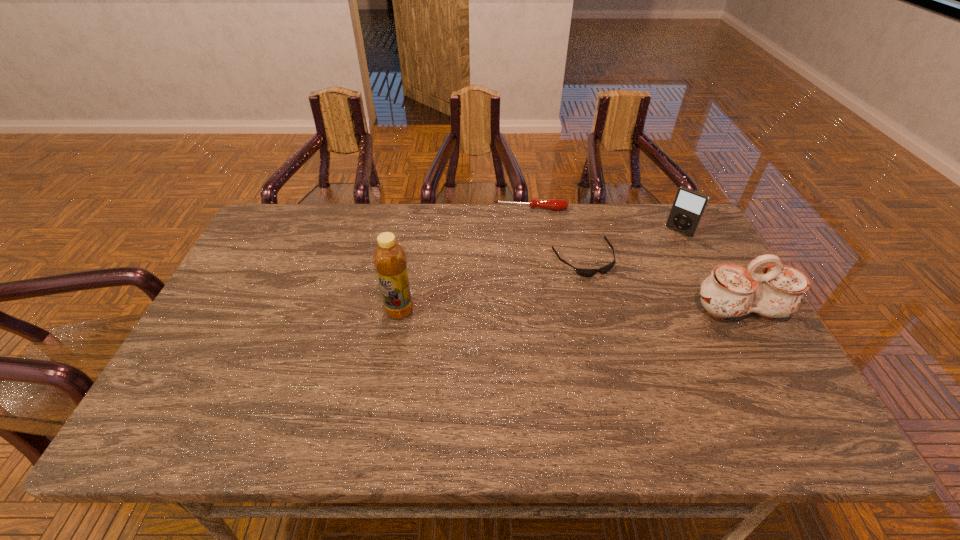
Identify the location of vacant spot on the desktop that is between the tallest object and the second tallest object and is positioned at the tip of the farthest object. Image resolution: width=960 pixels, height=540 pixels. pyautogui.click(x=529, y=310).

Locate an element on the screen. Image resolution: width=960 pixels, height=540 pixels. vacant spot on the desktop that is between the leftmost object and the chinaware and is positioned on the front-facing side of the shortest object is located at coordinates (618, 310).

The width and height of the screenshot is (960, 540). I want to click on free space on the desktop that is between the tallest object and the fourth shortest object and is positioned on the front-facing side of the fourth nearest object, so click(611, 310).